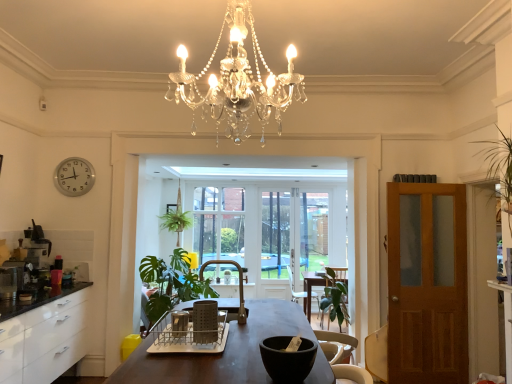
Question: Can you confirm if clear glass window screen at center, the 1th window screen from the right, is positioned to the right of green fabric armchair at center, which is the second armchair from top to bottom?

Choices:
 (A) yes
 (B) no

Answer: (B)

Question: Is clear glass window screen at center, the 1th window screen from the right, not within green fabric armchair at center, the second armchair in the front-to-back sequence?

Choices:
 (A) yes
 (B) no

Answer: (A)

Question: Is clear glass window screen at center, the 2th window screen viewed from the left, not close to green fabric armchair at center, which is the second armchair from top to bottom?

Choices:
 (A) yes
 (B) no

Answer: (A)

Question: From the image's perspective, is clear glass window screen at center, the 1th window screen from the right, under green fabric armchair at center, the 1th armchair in the back-to-front sequence?

Choices:
 (A) no
 (B) yes

Answer: (A)

Question: Can you confirm if clear glass window screen at center, the 1th window screen from the right, is wider than green fabric armchair at center, the 2th armchair from the left?

Choices:
 (A) yes
 (B) no

Answer: (B)

Question: From the image's perspective, is wooden swivel chair at right positioned above or below clear glass window screen at center, the 2th window screen viewed from the left?

Choices:
 (A) below
 (B) above

Answer: (A)

Question: Considering the positions of wooden swivel chair at right and clear glass window screen at center, the 1th window screen from the right, in the image, is wooden swivel chair at right taller or shorter than clear glass window screen at center, the 1th window screen from the right,?

Choices:
 (A) tall
 (B) short

Answer: (B)

Question: From a real-world perspective, is wooden swivel chair at right physically located above or below clear glass window screen at center, the 1th window screen from the right?

Choices:
 (A) above
 (B) below

Answer: (B)

Question: Relative to clear glass window screen at center, the 2th window screen viewed from the left, is wooden swivel chair at right in front or behind?

Choices:
 (A) behind
 (B) front

Answer: (B)

Question: From the image's perspective, relative to metallic silver coffee maker at left, is wooden swivel chair at right above or below?

Choices:
 (A) above
 (B) below

Answer: (B)

Question: In the image, is wooden swivel chair at right positioned in front of or behind metallic silver coffee maker at left?

Choices:
 (A) behind
 (B) front

Answer: (A)

Question: From a real-world perspective, relative to metallic silver coffee maker at left, is wooden swivel chair at right vertically above or below?

Choices:
 (A) above
 (B) below

Answer: (B)

Question: Based on their sizes in the image, would you say wooden swivel chair at right is bigger or smaller than metallic silver coffee maker at left?

Choices:
 (A) big
 (B) small

Answer: (B)

Question: Relative to clear glass window screen at center, the 2th window screen viewed from the left, is black matte bowl at center in front or behind?

Choices:
 (A) behind
 (B) front

Answer: (B)

Question: Considering the positions of black matte bowl at center and clear glass window screen at center, the 2th window screen viewed from the left, in the image, is black matte bowl at center bigger or smaller than clear glass window screen at center, the 2th window screen viewed from the left,?

Choices:
 (A) big
 (B) small

Answer: (B)